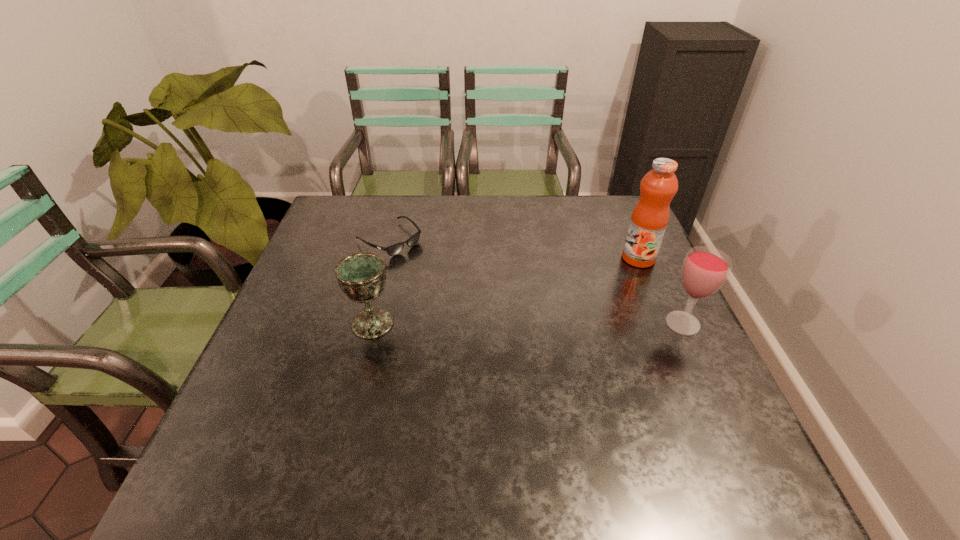
This screenshot has height=540, width=960. Find the location of `object that stands as the third closest to the chalice`. object that stands as the third closest to the chalice is located at coordinates (705, 269).

Choose which object is the second nearest neighbor to the sunglasses. Please provide its 2D coordinates. Your answer should be formatted as a tuple, i.e. [(x, y)], where the tuple contains the x and y coordinates of a point satisfying the conditions above.

[(649, 219)]

Image resolution: width=960 pixels, height=540 pixels. I want to click on free space that satisfies the following two spatial constraints: 1. on the back side of the fruit juice; 2. on the left side of the chalice, so click(389, 258).

At what (x,y) coordinates should I click in order to perform the action: click on vacant space that satisfies the following two spatial constraints: 1. on the front side of the wineglass; 2. on the right side of the fruit juice. Please return your answer as a coordinate pair (x, y). The width and height of the screenshot is (960, 540). Looking at the image, I should click on [x=666, y=323].